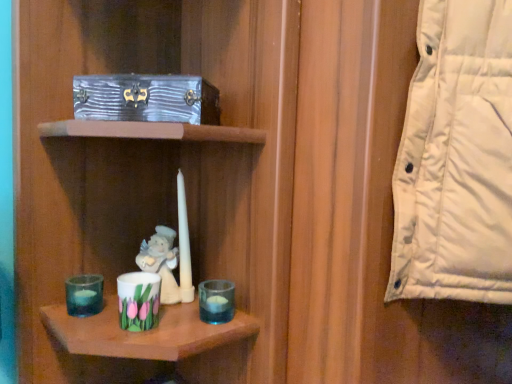
Question: Should I look upward or downward to see white matte birthday candle at center?

Choices:
 (A) down
 (B) up

Answer: (A)

Question: Is white matte birthday candle at center placed right next to porcelain angel at center?

Choices:
 (A) no
 (B) yes

Answer: (B)

Question: Does white matte birthday candle at center have a lesser width compared to porcelain angel at center?

Choices:
 (A) no
 (B) yes

Answer: (B)

Question: From a real-world perspective, is white matte birthday candle at center under porcelain angel at center?

Choices:
 (A) no
 (B) yes

Answer: (A)

Question: Is white matte birthday candle at center at the left side of porcelain angel at center?

Choices:
 (A) yes
 (B) no

Answer: (B)

Question: Is white matte birthday candle at center facing away from porcelain angel at center?

Choices:
 (A) yes
 (B) no

Answer: (B)

Question: From a real-world perspective, is white matte birthday candle at center on porcelain angel at center?

Choices:
 (A) yes
 (B) no

Answer: (A)

Question: From a real-world perspective, is white matte birthday candle at center over metallic silver box at upper left?

Choices:
 (A) yes
 (B) no

Answer: (B)

Question: Are white matte birthday candle at center and metallic silver box at upper left beside each other?

Choices:
 (A) yes
 (B) no

Answer: (B)

Question: Is white matte birthday candle at center wider than metallic silver box at upper left?

Choices:
 (A) yes
 (B) no

Answer: (B)

Question: Does white matte birthday candle at center appear on the left side of metallic silver box at upper left?

Choices:
 (A) no
 (B) yes

Answer: (A)

Question: Is metallic silver box at upper left at the back of white matte birthday candle at center?

Choices:
 (A) yes
 (B) no

Answer: (B)

Question: From the image's perspective, is white matte birthday candle at center located beneath metallic silver box at upper left?

Choices:
 (A) no
 (B) yes

Answer: (B)

Question: Is porcelain floral cup at lower center, placed as the 2th candle holder when sorted from right to left, to the left of transparent glass candle holder at lower left, acting as the first candle holder starting from the left, from the viewer's perspective?

Choices:
 (A) yes
 (B) no

Answer: (B)